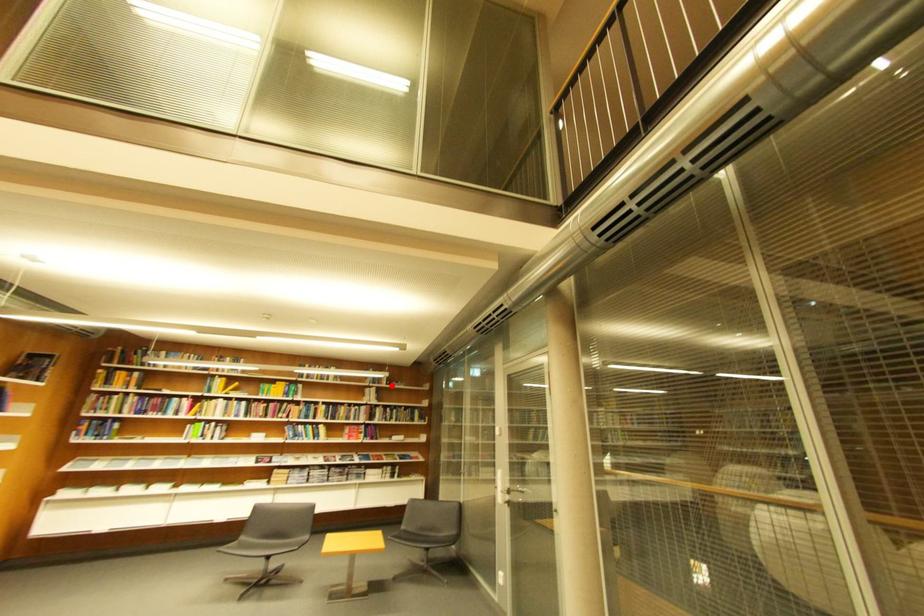
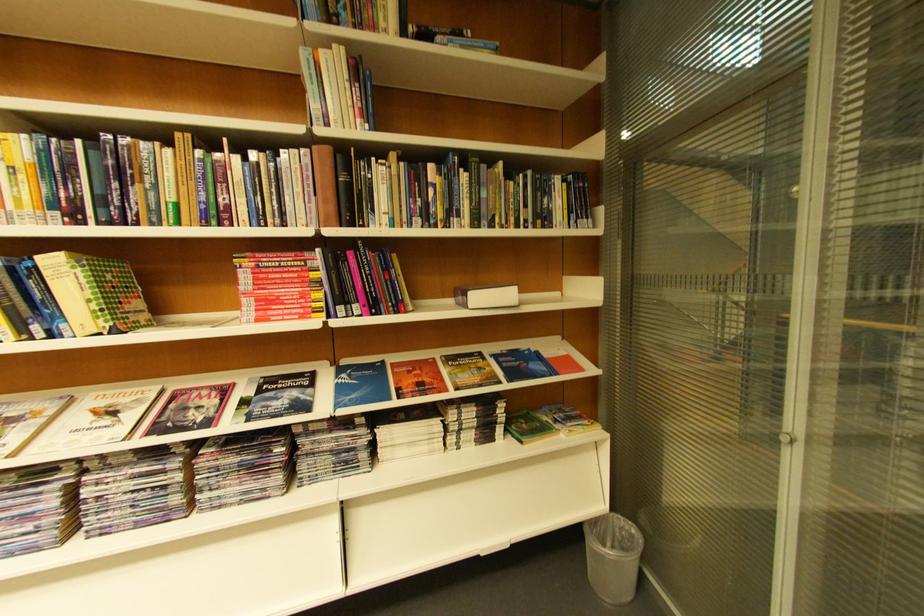
Question: I am providing you with two images of the same scene from different viewpoints. In image1, a red point is highlighted. Considering the same 3D point in image2, which of the following is correct?

Choices:
 (A) It is closer
 (B) It is farther

Answer: (A)